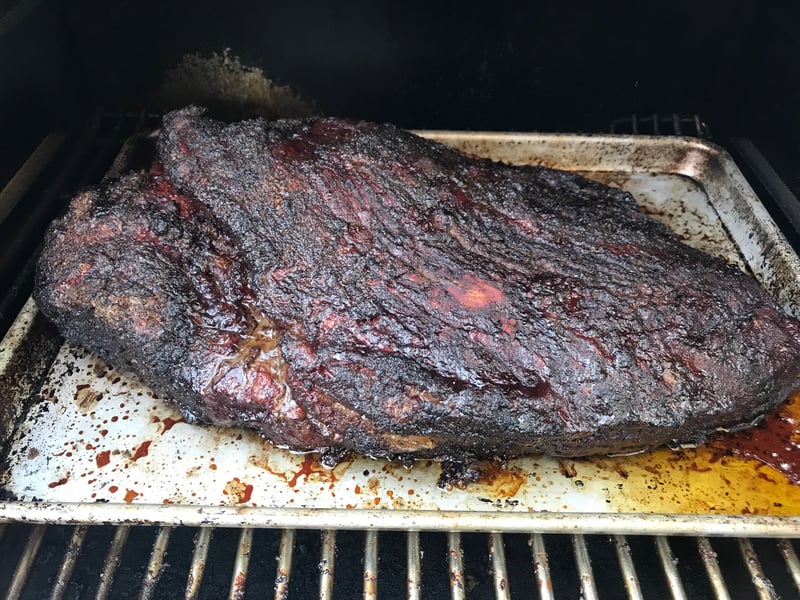
Locate an element on the screen. Image resolution: width=800 pixels, height=600 pixels. rim of tray is located at coordinates (22, 334), (268, 521), (646, 137).